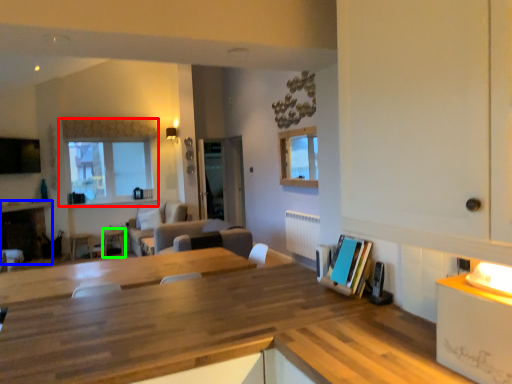
Question: Estimate the real-world distances between objects in this image. Which object is farther from window (highlighted by a red box), fireplace (highlighted by a blue box) or table (highlighted by a green box)?

Choices:
 (A) fireplace
 (B) table

Answer: (B)